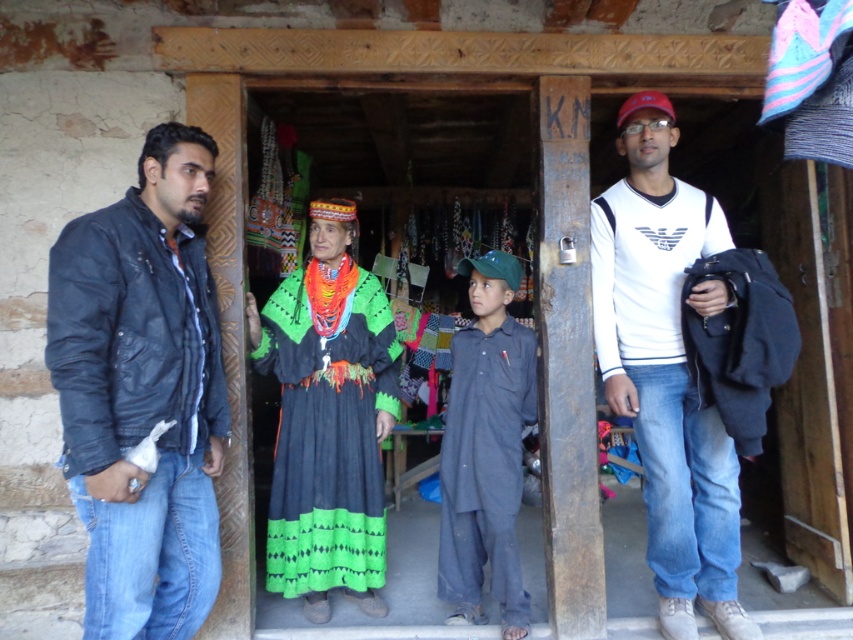
You are standing at point (651, 97) and want to walk to the entrance of the shop. Is the point (175, 323) in your path?

Yes, the point (175, 323) is in your path because it is in front of your current position at point (651, 97).